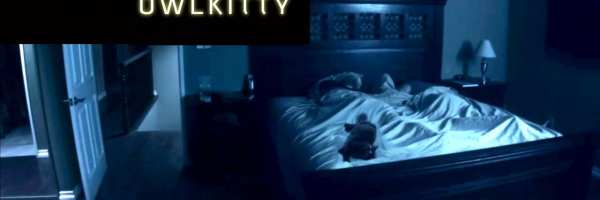
The height and width of the screenshot is (200, 600). Identify the location of floor. (166, 176).